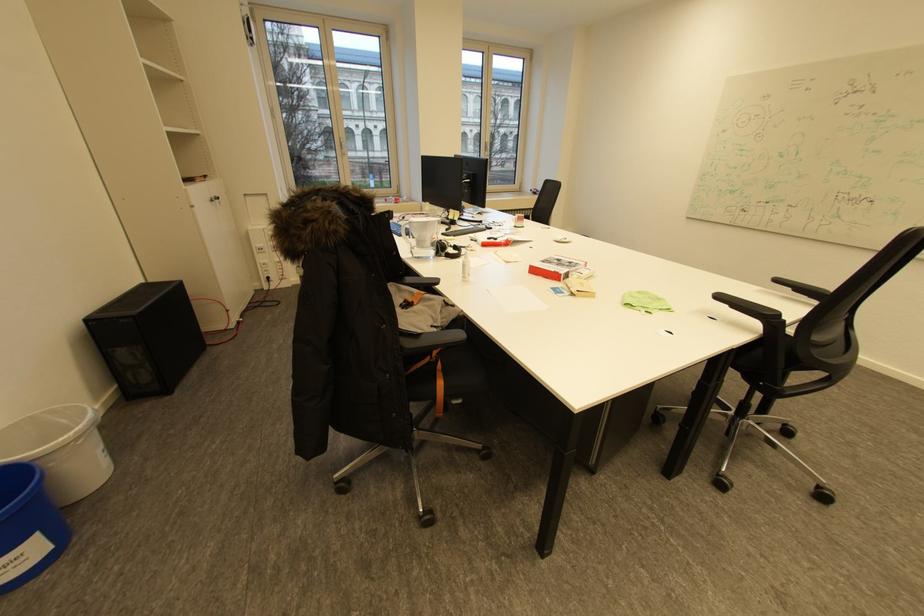
Where would you lift the blue trash can? Please return your answer as a coordinate pair (x, y).

(27, 525)